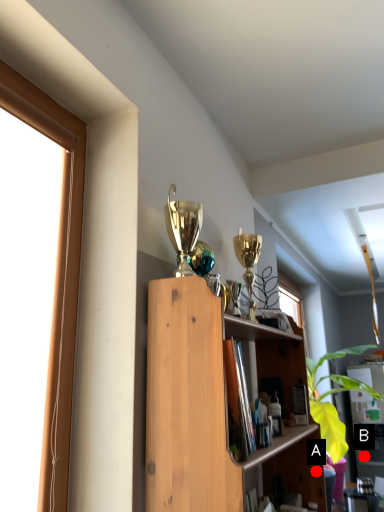
Question: Two points are circled on the image, labeled by A and B beside each circle. Which point is farther from the camera taking this photo?

Choices:
 (A) A is further
 (B) B is further

Answer: (B)